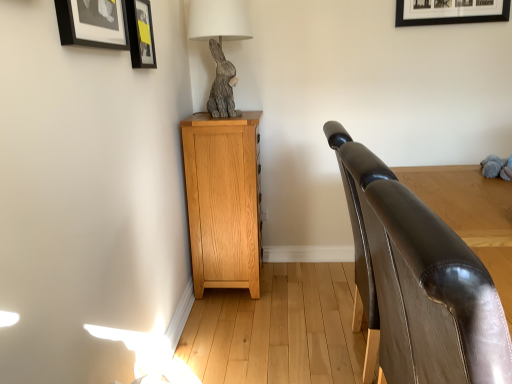
Question: Should I look upward or downward to see light oak cabinet at left?

Choices:
 (A) up
 (B) down

Answer: (B)

Question: Does gray textured rabbit at upper left have a smaller size compared to light oak cabinet at left?

Choices:
 (A) yes
 (B) no

Answer: (A)

Question: Is gray textured rabbit at upper left positioned in front of light oak cabinet at left?

Choices:
 (A) yes
 (B) no

Answer: (A)

Question: From the image's perspective, is gray textured rabbit at upper left below light oak cabinet at left?

Choices:
 (A) yes
 (B) no

Answer: (B)

Question: From a real-world perspective, is gray textured rabbit at upper left beneath light oak cabinet at left?

Choices:
 (A) yes
 (B) no

Answer: (B)

Question: Is gray textured rabbit at upper left positioned with its back to light oak cabinet at left?

Choices:
 (A) no
 (B) yes

Answer: (A)

Question: Is gray textured rabbit at upper left taller than light oak cabinet at left?

Choices:
 (A) no
 (B) yes

Answer: (A)

Question: Can you confirm if gray plush toy at right is bigger than light oak cabinet at left?

Choices:
 (A) no
 (B) yes

Answer: (A)

Question: From a real-world perspective, does gray plush toy at right stand above light oak cabinet at left?

Choices:
 (A) yes
 (B) no

Answer: (A)

Question: Would you say gray plush toy at right is a long distance from light oak cabinet at left?

Choices:
 (A) no
 (B) yes

Answer: (B)

Question: Does gray plush toy at right appear on the right side of light oak cabinet at left?

Choices:
 (A) yes
 (B) no

Answer: (A)

Question: Does gray plush toy at right have a lesser width compared to light oak cabinet at left?

Choices:
 (A) yes
 (B) no

Answer: (A)

Question: Is gray plush toy at right oriented towards light oak cabinet at left?

Choices:
 (A) no
 (B) yes

Answer: (A)

Question: Considering the relative sizes of shiny brown leather armrest at right and matte black picture frame at upper left, placed as the 2th picture frame when sorted from front to back, in the image provided, is shiny brown leather armrest at right smaller than matte black picture frame at upper left, placed as the 2th picture frame when sorted from front to back,?

Choices:
 (A) no
 (B) yes

Answer: (A)